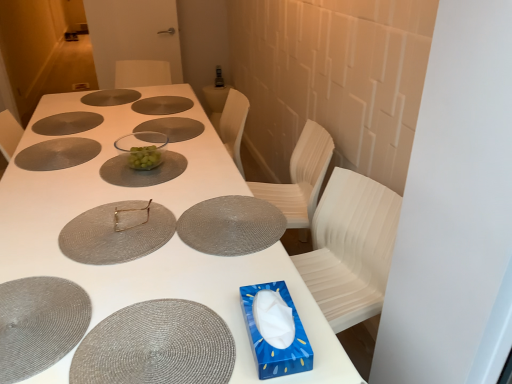
Locate an element on the screen. free area behind woven gray placemat at lower left is located at coordinates (36, 245).